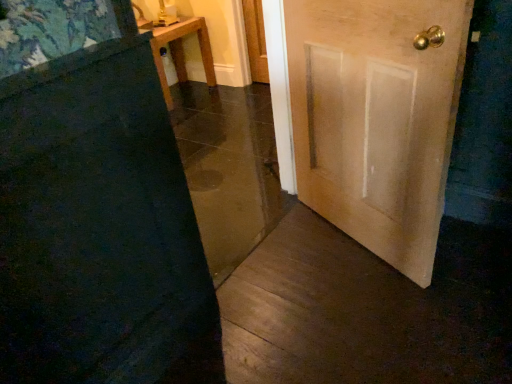
Where is `free space above wooden door at center, marked as the 2th door in a right-to-left arrangement (from a real-world perspective)`? This screenshot has height=384, width=512. free space above wooden door at center, marked as the 2th door in a right-to-left arrangement (from a real-world perspective) is located at coordinates (60, 62).